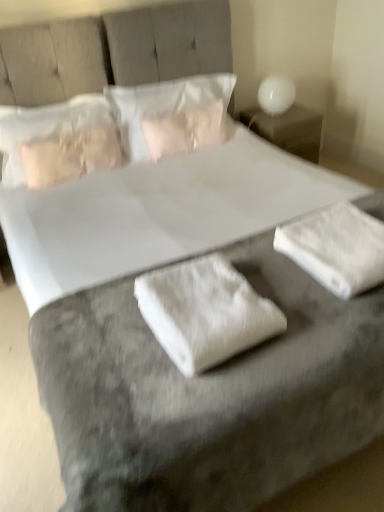
Find the location of a particular element. free space to the right of white fabric at center, positioned as the first material in left-to-right order is located at coordinates (295, 303).